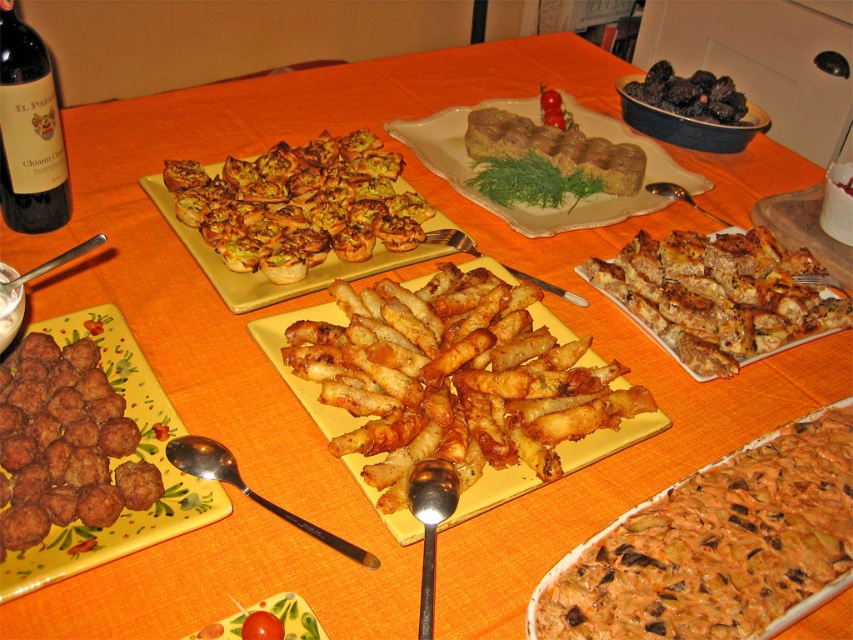
Question: Which of the following is the closest to the observer?

Choices:
 (A) (459, 168)
 (B) (61, 433)
 (C) (552, 145)
 (D) (747, 518)

Answer: (D)

Question: Observing the image, what is the correct spatial positioning of golden crispy fries at center in reference to brown crumbly meatballs at lower left?

Choices:
 (A) left
 (B) right

Answer: (B)

Question: Is golden crispy fries at center to the left of brown crumbly meatballs at lower left from the viewer's perspective?

Choices:
 (A) no
 (B) yes

Answer: (A)

Question: Among these objects, which one is farthest from the camera?

Choices:
 (A) smooth creamy pasta at center
 (B) brown crumbly pastry at center
 (C) brown crumbly bread at center right

Answer: (B)

Question: Is brown crumbly meatballs at lower left to the left of brown textured meatloaf at center from the viewer's perspective?

Choices:
 (A) no
 (B) yes

Answer: (B)

Question: Among these objects, which one is nearest to the camera?

Choices:
 (A) smooth creamy pasta at center
 (B) dark red glass bottle at upper left
 (C) black matte truffles at upper right

Answer: (A)